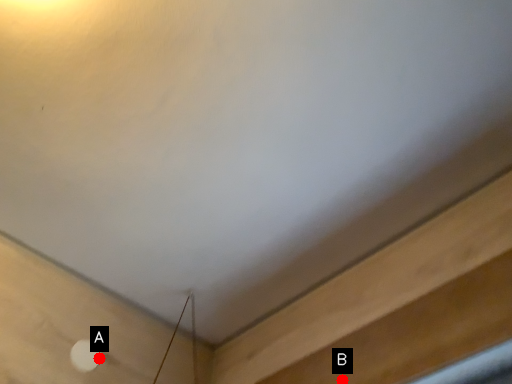
Question: Two points are circled on the image, labeled by A and B beside each circle. Which of the following is the farthest from the observer?

Choices:
 (A) A is further
 (B) B is further

Answer: (A)